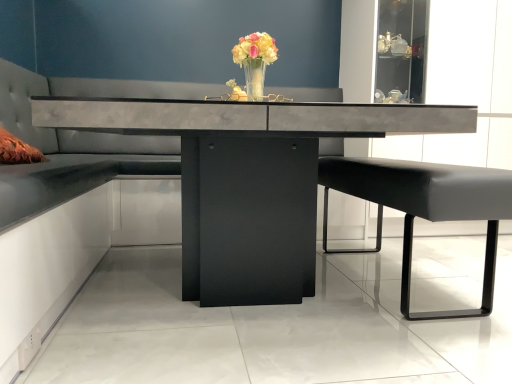
Question: From the image's perspective, does concrete table at center appear higher than black leather bench at right?

Choices:
 (A) no
 (B) yes

Answer: (B)

Question: Is concrete table at center to the right of black leather bench at right from the viewer's perspective?

Choices:
 (A) no
 (B) yes

Answer: (A)

Question: From a real-world perspective, is concrete table at center positioned over black leather bench at right based on gravity?

Choices:
 (A) no
 (B) yes

Answer: (B)

Question: Considering the relative sizes of concrete table at center and black leather bench at right in the image provided, is concrete table at center thinner than black leather bench at right?

Choices:
 (A) no
 (B) yes

Answer: (A)

Question: Is concrete table at center shorter than black leather bench at right?

Choices:
 (A) yes
 (B) no

Answer: (B)

Question: Considering the positions of tufted leather couch at center and concrete table at center in the image, is tufted leather couch at center taller or shorter than concrete table at center?

Choices:
 (A) short
 (B) tall

Answer: (B)

Question: In the image, is tufted leather couch at center positioned in front of or behind concrete table at center?

Choices:
 (A) behind
 (B) front

Answer: (A)

Question: From the image's perspective, is tufted leather couch at center positioned above or below concrete table at center?

Choices:
 (A) below
 (B) above

Answer: (B)

Question: In terms of size, does tufted leather couch at center appear bigger or smaller than concrete table at center?

Choices:
 (A) small
 (B) big

Answer: (A)

Question: In the image, is translucent glass vase at center on the left side or the right side of black leather bench at right?

Choices:
 (A) left
 (B) right

Answer: (A)

Question: From the image's perspective, is translucent glass vase at center positioned above or below black leather bench at right?

Choices:
 (A) below
 (B) above

Answer: (B)

Question: In the image, is translucent glass vase at center positioned in front of or behind black leather bench at right?

Choices:
 (A) behind
 (B) front

Answer: (A)

Question: From a real-world perspective, is translucent glass vase at center positioned above or below black leather bench at right?

Choices:
 (A) above
 (B) below

Answer: (A)

Question: Considering the positions of concrete table at center and translucent glass vase at center in the image, is concrete table at center wider or thinner than translucent glass vase at center?

Choices:
 (A) wide
 (B) thin

Answer: (A)

Question: From a real-world perspective, is concrete table at center physically located above or below translucent glass vase at center?

Choices:
 (A) above
 (B) below

Answer: (B)